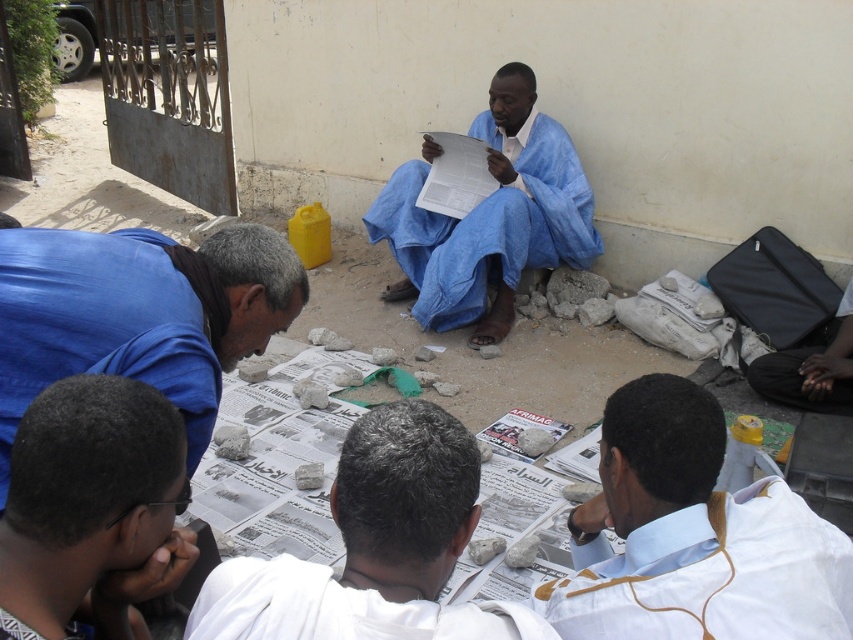
You are standing in the scene and want to reach both points, point 1 at coordinates point (440, 449) and point 2 at coordinates point (846, 365). Which point will you reach first if you move directly towards them?

Point 1 at coordinates point (440, 449) will be reached first because it is closer to the viewer than point 2 at coordinates point (846, 365).

You are a delivery person who needs to place a small package between the white cloth at center and the dark blue fabric bag at lower right. Based on the scene, where should you place the package?

The white cloth at center is to the left of the dark blue fabric bag at lower right, so you should place the package between them on the right side of the white cloth at center and the left side of the dark blue fabric bag at lower right.